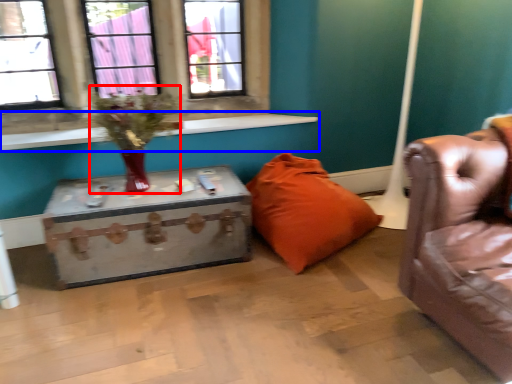
Question: Among these objects, which one is farthest to the camera, floral arrangement (highlighted by a red box) or window sill (highlighted by a blue box)?

Choices:
 (A) floral arrangement
 (B) window sill

Answer: (B)